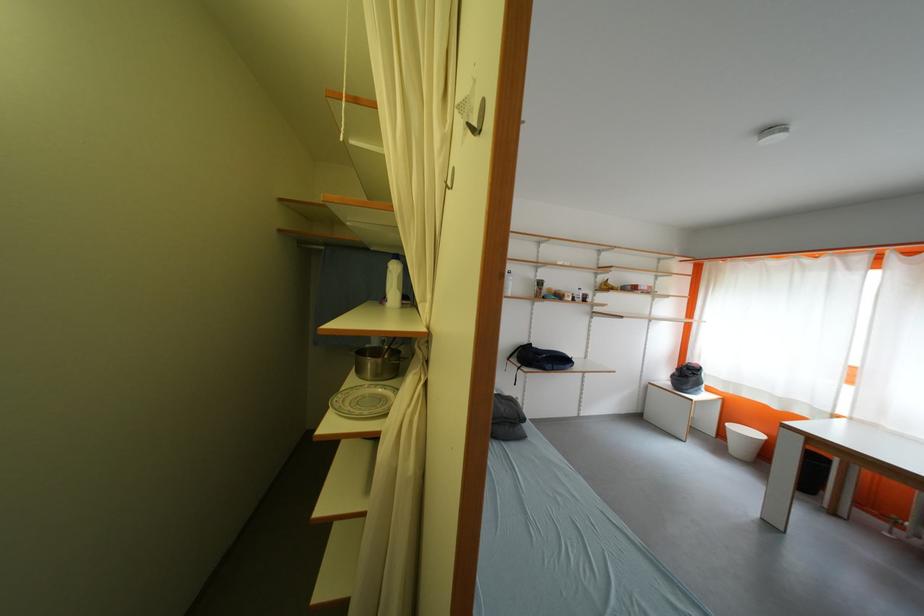
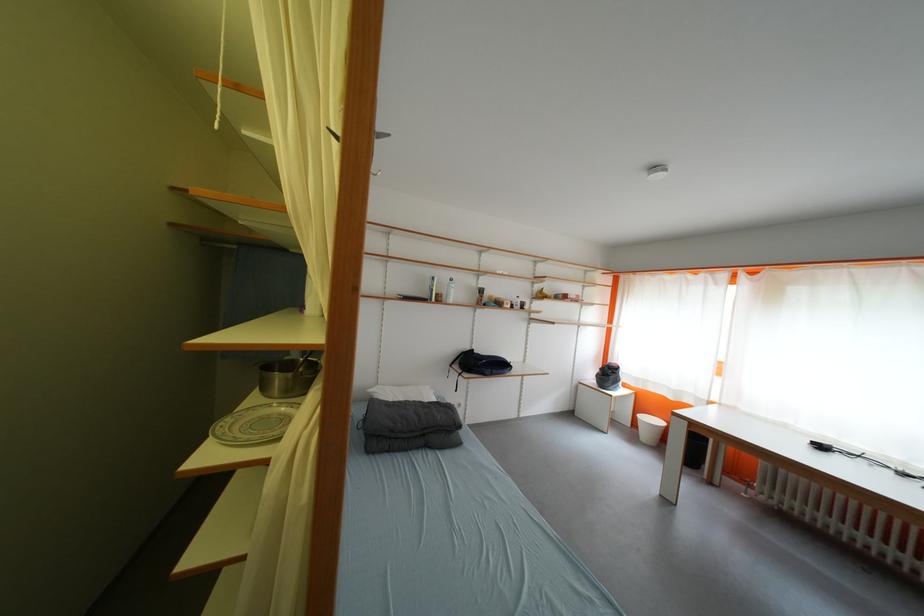
In the second image, find the point that corresponds to [687,373] in the first image.

(610, 371)